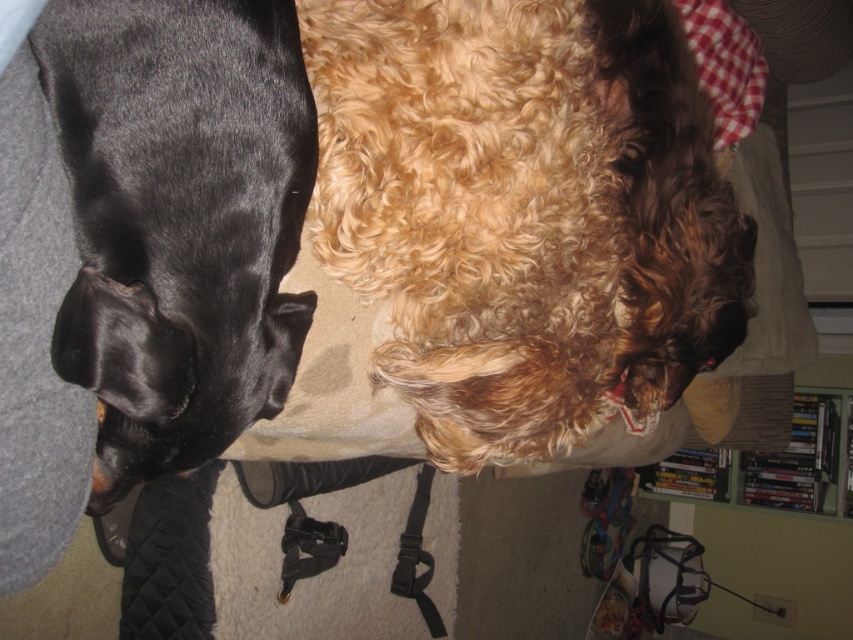
You are standing in the living room where the two dogs are resting. You need to place a small toy between the two points marked as point (x=473, y=177) and point (x=68, y=157). Which point should the toy be closer to if it needs to be placed in front of the dogs?

The toy should be placed closer to point (x=68, y=157) because point (x=473, y=177) is behind point (x=68, y=157), so placing it near the front point would ensure it is in front of the dogs.

You are a photographer setting up a tripod to take a portrait of both the curly golden fur at upper center and the shiny black dog at left. Since you want both subjects to be in focus, you need to adjust the camera so that the depth of field can cover both. Given their height difference, which dog should you focus on to ensure both are sharp?

Since the curly golden fur at upper center is much taller than the shiny black dog at left, you should focus on the taller subject, the curly golden fur at upper center, to ensure both are in focus.